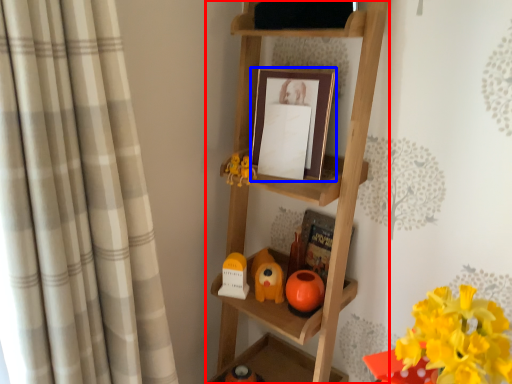
Question: Which point is further to the camera, shelf (highlighted by a red box) or picture frame (highlighted by a blue box)?

Choices:
 (A) shelf
 (B) picture frame

Answer: (B)